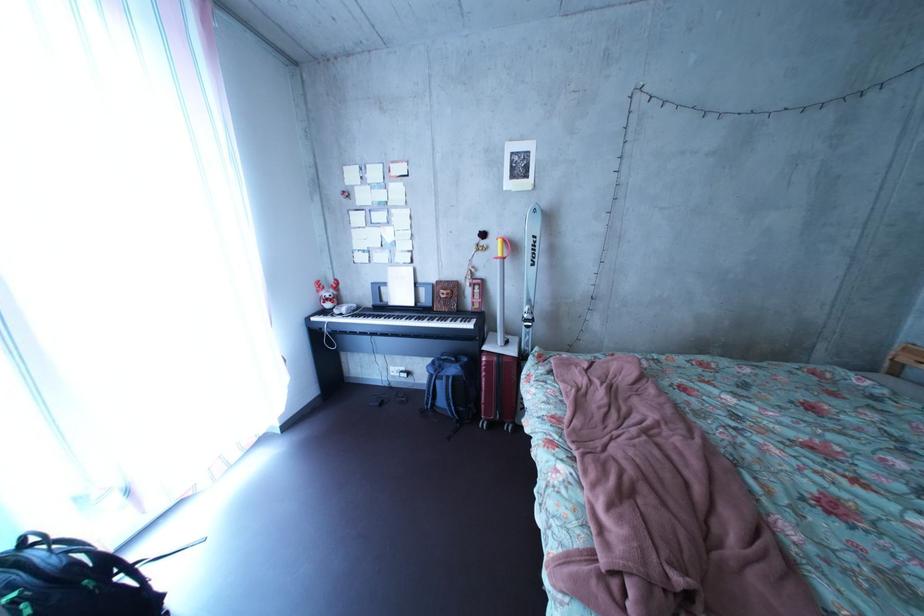
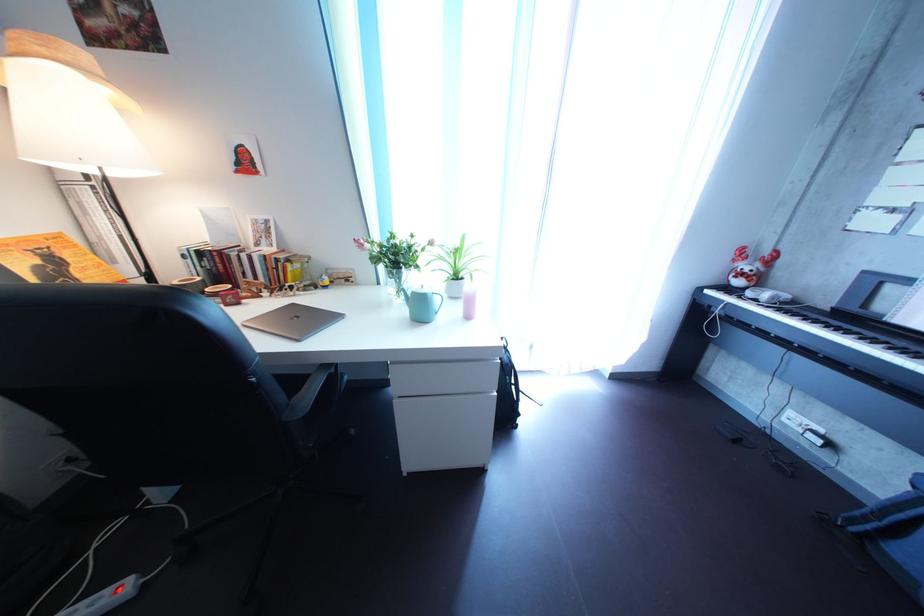
Where in the second image is the point corresponding to the point at 368,314 from the first image?

(801, 304)